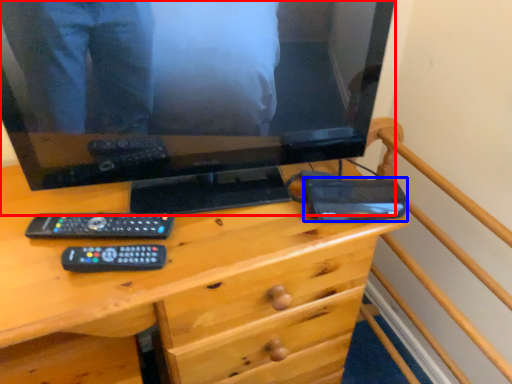
Question: Which object appears farthest to the camera in this image, television (highlighted by a red box) or gadget (highlighted by a blue box)?

Choices:
 (A) television
 (B) gadget

Answer: (B)